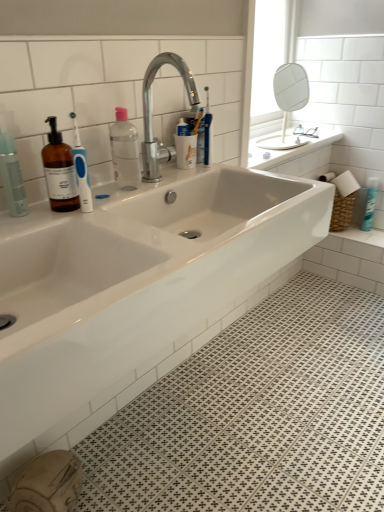
Find the location of a particular element. free location in front of transparent plastic bottle at center is located at coordinates (121, 200).